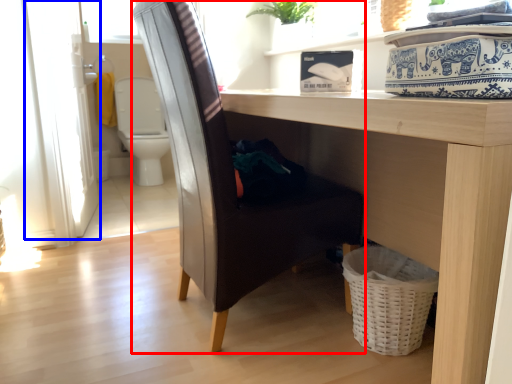
Question: Which point is further to the camera, chair (highlighted by a red box) or screen door (highlighted by a blue box)?

Choices:
 (A) chair
 (B) screen door

Answer: (B)